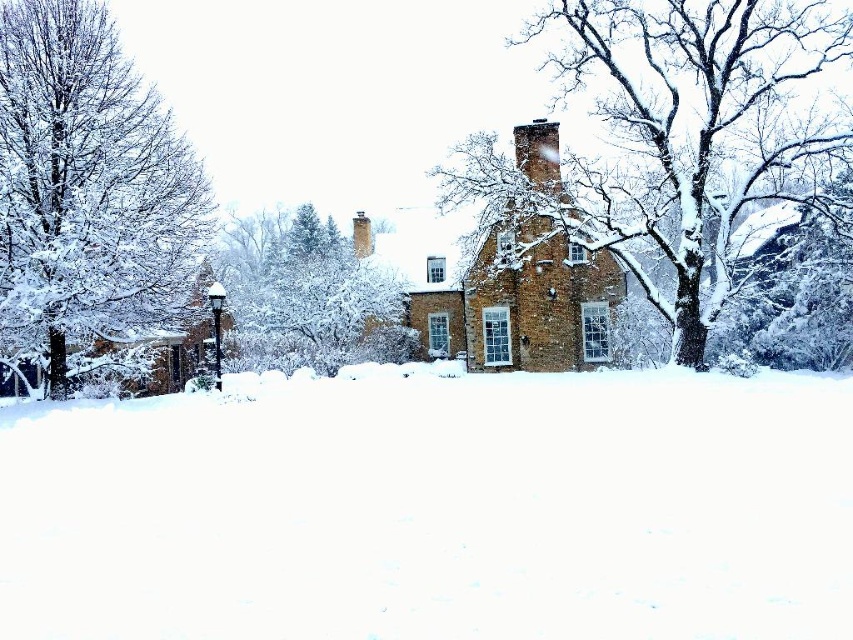
You are standing in front of the house and notice two points marked on the snow. The first point is at coordinates point (627, 138) and the second is at point (283, 342). If you want to walk from the closer point to the farther one, which point should you start at?

You should start at point (283, 342) because it is closer to you, and then walk towards point (627, 138) which is farther away.